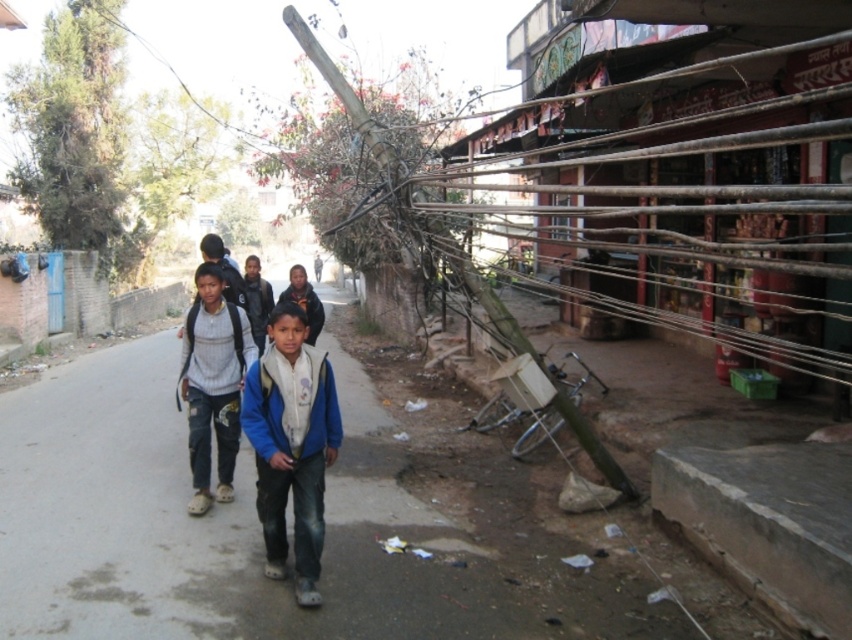
You are a parent looking for your child who is wearing either the blue fleece jacket at center or the knitted sweater at center. You see both items hanging on a clothesline between two poles. Which item is closer to the ground?

The blue fleece jacket at center is positioned under the knitted sweater at center, so the blue fleece jacket at center is closer to the ground.

Consider the image. You are a parent trying to locate your child in a crowded street scene. You remember your child was wearing a blue fleece jacket at center and a knitted sweater at center. Which piece of clothing is positioned to the right of the other?

The blue fleece jacket at center is to the right of the knitted sweater at center.